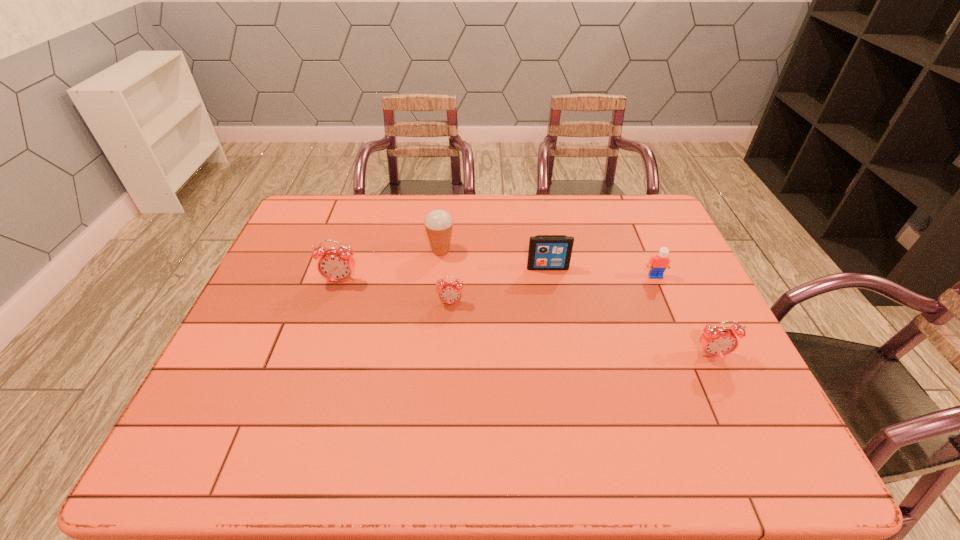
Find the location of a particular element. the leftmost alarm clock is located at coordinates (337, 265).

Locate an element on the screen. The image size is (960, 540). the farthest alarm clock is located at coordinates (337, 265).

This screenshot has height=540, width=960. I want to click on the second alarm clock from right to left, so click(450, 292).

Locate an element on the screen. The height and width of the screenshot is (540, 960). the second farthest alarm clock is located at coordinates (450, 292).

Locate an element on the screen. The image size is (960, 540). the nearest alarm clock is located at coordinates (716, 341).

Locate an element on the screen. the second shortest alarm clock is located at coordinates [716, 341].

This screenshot has height=540, width=960. I want to click on Lego, so click(x=658, y=264).

Image resolution: width=960 pixels, height=540 pixels. I want to click on iPod, so click(x=546, y=252).

The width and height of the screenshot is (960, 540). I want to click on the second farthest object, so click(546, 252).

Where is `icecream`? The width and height of the screenshot is (960, 540). icecream is located at coordinates (438, 223).